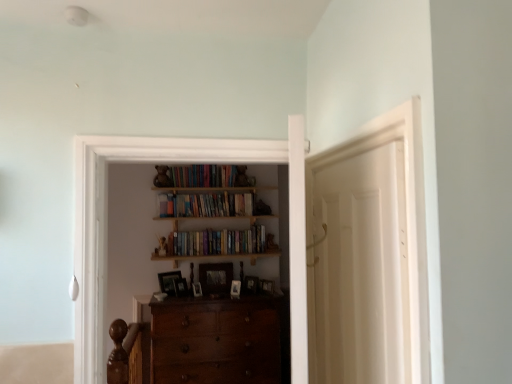
Question: Can you confirm if wooden photo frame at center, arranged as the fifth picture frame when viewed from the right, is shorter than wooden bookshelf at upper center, the first book from the top?

Choices:
 (A) yes
 (B) no

Answer: (A)

Question: Does wooden photo frame at center, arranged as the fifth picture frame when viewed from the right, appear on the left side of wooden bookshelf at upper center, the first book from the top?

Choices:
 (A) no
 (B) yes

Answer: (B)

Question: Does wooden photo frame at center, arranged as the fifth picture frame when viewed from the right, have a lesser width compared to wooden bookshelf at upper center, acting as the second book starting from the bottom?

Choices:
 (A) no
 (B) yes

Answer: (B)

Question: From the image's perspective, is wooden photo frame at center, arranged as the fifth picture frame when viewed from the right, located above wooden bookshelf at upper center, the first book from the top?

Choices:
 (A) yes
 (B) no

Answer: (B)

Question: Is wooden photo frame at center, arranged as the fifth picture frame when viewed from the right, far from wooden bookshelf at upper center, the first book from the top?

Choices:
 (A) no
 (B) yes

Answer: (A)

Question: In terms of width, does wooden picture frame at center, the second picture frame positioned from the right, look wider or thinner when compared to wooden photo frame at center, placed as the sixth picture frame when sorted from right to left?

Choices:
 (A) wide
 (B) thin

Answer: (A)

Question: Based on their sizes in the image, would you say wooden picture frame at center, the second picture frame positioned from the right, is bigger or smaller than wooden photo frame at center, placed as the second picture frame when sorted from left to right?

Choices:
 (A) small
 (B) big

Answer: (B)

Question: Would you say wooden picture frame at center, which is counted as the sixth picture frame, starting from the left, is inside or outside wooden photo frame at center, placed as the second picture frame when sorted from left to right?

Choices:
 (A) inside
 (B) outside

Answer: (B)

Question: From their relative heights in the image, would you say wooden picture frame at center, the second picture frame positioned from the right, is taller or shorter than wooden photo frame at center, placed as the sixth picture frame when sorted from right to left?

Choices:
 (A) short
 (B) tall

Answer: (B)

Question: Choose the correct answer: Is wooden picture frame at center, marked as the fifth picture frame in a left-to-right arrangement, inside wooden picture frame at center, which is counted as the sixth picture frame, starting from the left, or outside it?

Choices:
 (A) inside
 (B) outside

Answer: (B)

Question: From the image's perspective, is wooden picture frame at center, the 3th picture frame positioned from the right, located above or below wooden picture frame at center, the second picture frame positioned from the right?

Choices:
 (A) below
 (B) above

Answer: (A)

Question: Relative to wooden picture frame at center, the second picture frame positioned from the right, is wooden picture frame at center, marked as the fifth picture frame in a left-to-right arrangement, in front or behind?

Choices:
 (A) behind
 (B) front

Answer: (A)

Question: In terms of width, does wooden picture frame at center, the 3th picture frame positioned from the right, look wider or thinner when compared to wooden picture frame at center, which is counted as the sixth picture frame, starting from the left?

Choices:
 (A) thin
 (B) wide

Answer: (A)

Question: From the image's perspective, is woodenmaterial/texture entertainment center at center located above or below wooden photo frame at center, the third picture frame when ordered from left to right?

Choices:
 (A) above
 (B) below

Answer: (A)

Question: Considering their positions, is woodenmaterial/texture entertainment center at center located in front of or behind wooden photo frame at center, the third picture frame when ordered from left to right?

Choices:
 (A) behind
 (B) front

Answer: (B)